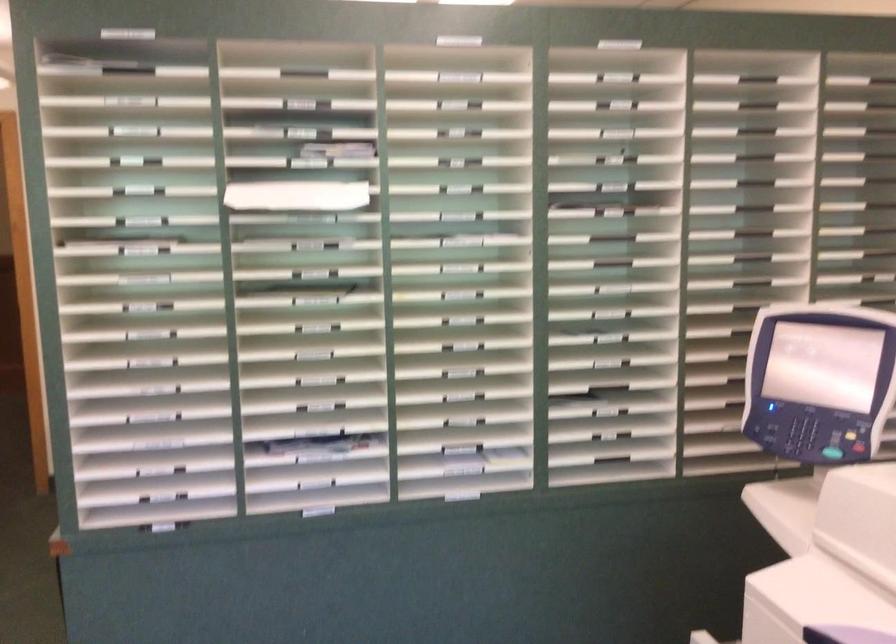
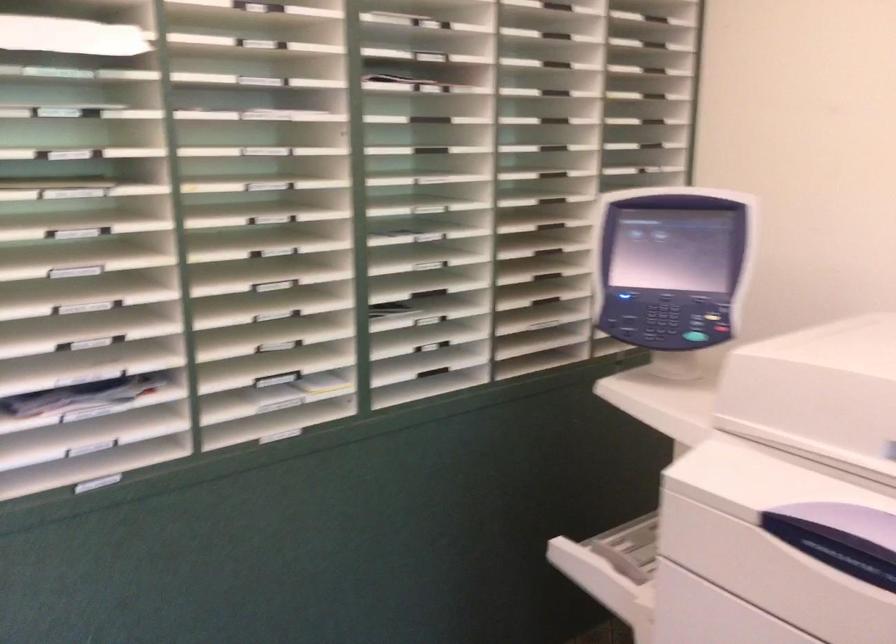
Question: The camera is either moving clockwise (left) or counter-clockwise (right) around the object. The first image is from the beginning of the video and the second image is from the end. Is the camera moving left or right when shooting the video?

Choices:
 (A) Left
 (B) Right

Answer: (A)